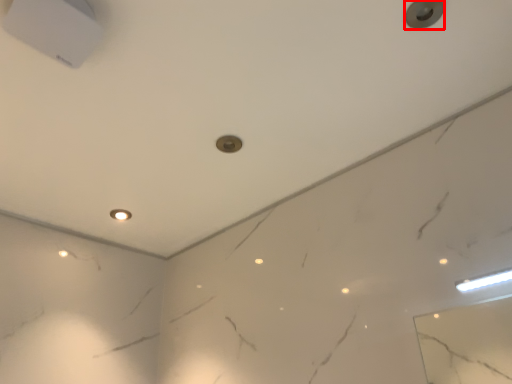
Question: From the image's perspective, considering the relative positions of knob (annotated by the red box) and dot in the image provided, where is knob (annotated by the red box) located with respect to the staircase?

Choices:
 (A) below
 (B) above

Answer: (B)